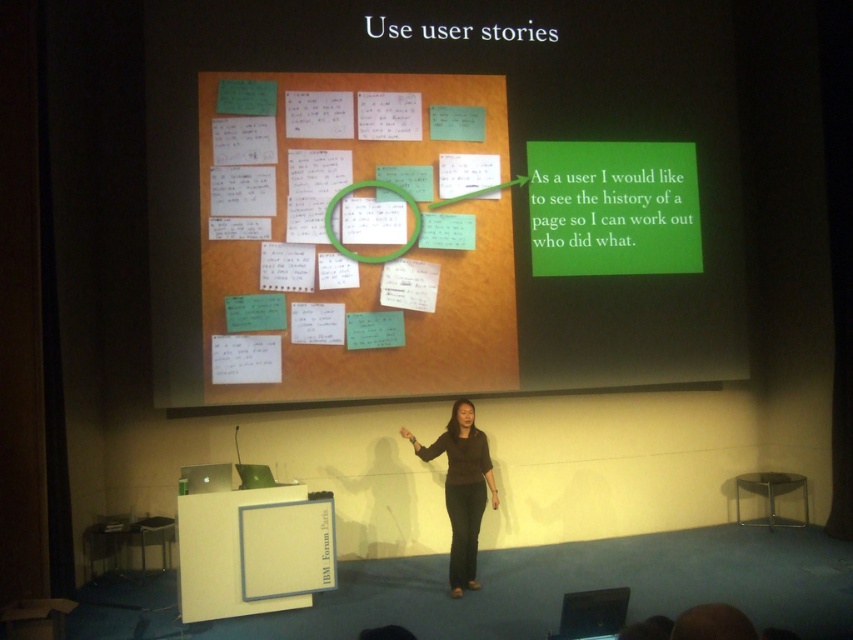
Is point (450, 552) positioned in front of point (328, 202)?

No, (450, 552) is behind (328, 202).

Between point (450, 572) and point (407, 246), which one is positioned in front?

Point (450, 572) is in front.

The height and width of the screenshot is (640, 853). In order to click on brown fabric pants at lower center in this screenshot , I will do `click(461, 488)`.

Which of these two, green paper notes at center or green plastic magnifying glass at upper center, stands taller?

green paper notes at center is taller.

Who is more distant from viewer, (x=254, y=218) or (x=366, y=256)?

The point (x=366, y=256) is more distant.

Is point (430, 129) less distant than point (328, 236)?

No.

Image resolution: width=853 pixels, height=640 pixels. What are the coordinates of `green paper notes at center` in the screenshot? It's located at (355, 236).

Between white paper at upper center and brown fabric pants at lower center, which one is positioned higher?

white paper at upper center

Does white paper at upper center appear on the right side of brown fabric pants at lower center?

Indeed, white paper at upper center is positioned on the right side of brown fabric pants at lower center.

Between point (206, 90) and point (456, 484), which one is positioned behind?

Point (206, 90)

Find the location of a particular element. This screenshot has height=640, width=853. white paper at upper center is located at coordinates (444, 195).